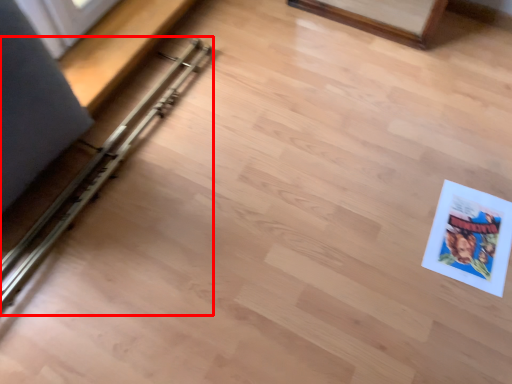
Question: From the image, what is the correct spatial relationship of rail (annotated by the red box) in relation to comic book?

Choices:
 (A) left
 (B) right

Answer: (A)